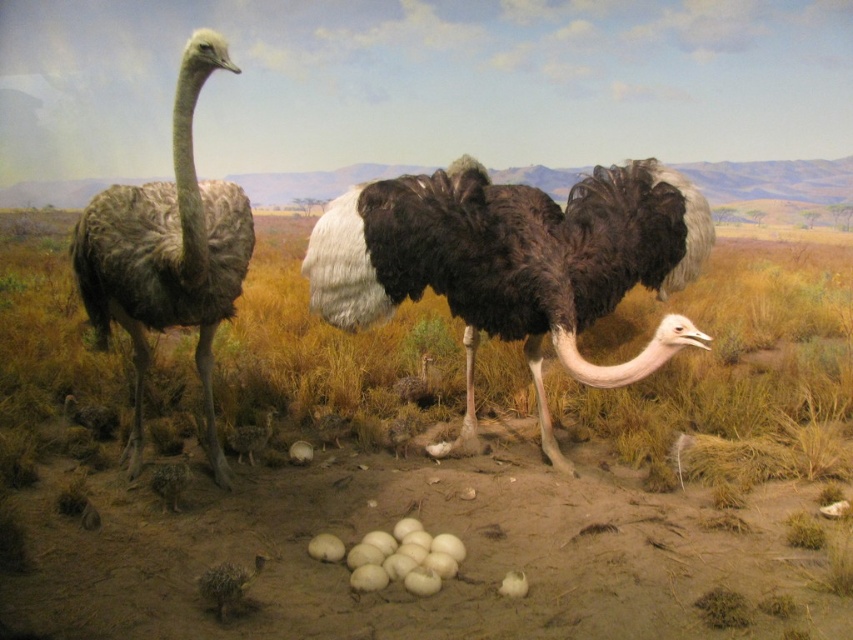
Question: Is the position of brown sandy dirt at center less distant than that of dark brown feathers at left?

Choices:
 (A) yes
 (B) no

Answer: (B)

Question: In this image, where is dark brown feathers at center located relative to dark brown feathers at left?

Choices:
 (A) below
 (B) above

Answer: (A)

Question: Among these objects, which one is farthest from the camera?

Choices:
 (A) dark brown feathers at left
 (B) dark brown feathers at center
 (C) brown sandy dirt at center

Answer: (B)

Question: Which of the following is the farthest from the observer?

Choices:
 (A) brown sandy dirt at center
 (B) dark brown feathers at left

Answer: (A)

Question: Which object is positioned closest to the dark brown feathers at left?

Choices:
 (A) brown sandy dirt at center
 (B) dark brown feathers at center

Answer: (B)

Question: Can you confirm if dark brown feathers at center is positioned to the right of dark brown feathers at left?

Choices:
 (A) no
 (B) yes

Answer: (B)